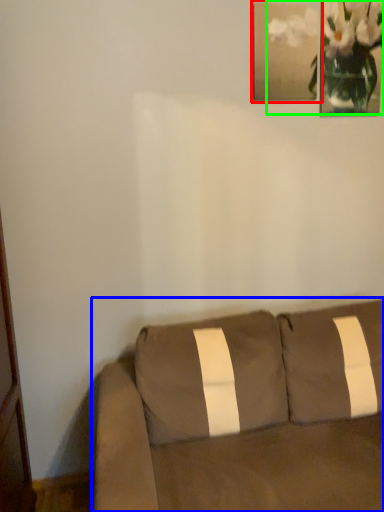
Question: Which is nearer to the picture frame (highlighted by a red box)? studio couch (highlighted by a blue box) or floral arrangement (highlighted by a green box).

Choices:
 (A) studio couch
 (B) floral arrangement

Answer: (B)